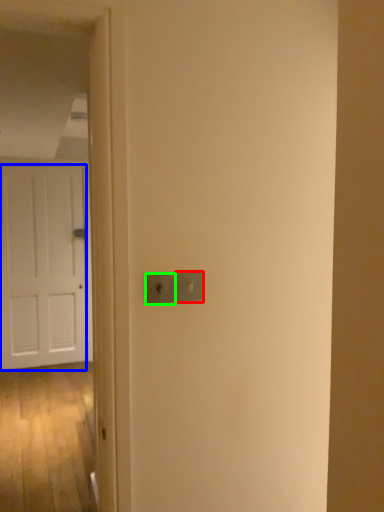
Question: Estimate the real-world distances between objects in this image. Which object is farther from light switch (highlighted by a red box), door (highlighted by a blue box) or light switch (highlighted by a green box)?

Choices:
 (A) door
 (B) light switch

Answer: (A)